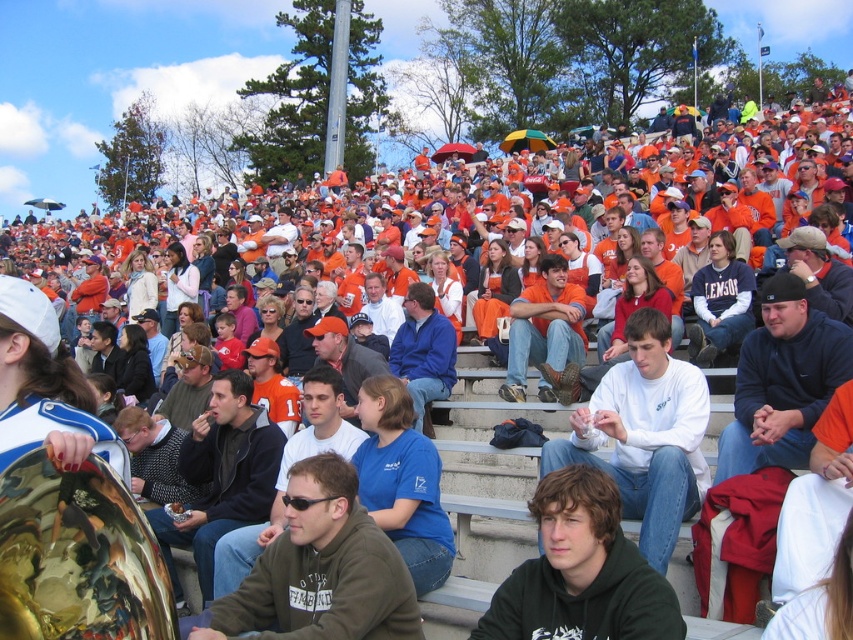
In the scene shown: Does dark blue jacket at center have a smaller size compared to orange fabric shirt at center?

Actually, dark blue jacket at center might be larger than orange fabric shirt at center.

Which is behind, point (178, 584) or point (525, 378)?

Positioned behind is point (525, 378).

The height and width of the screenshot is (640, 853). I want to click on dark blue jacket at center, so click(x=222, y=476).

The width and height of the screenshot is (853, 640). In order to click on dark blue jacket at center in this screenshot , I will do `click(222, 476)`.

Can you confirm if green hoodie at center is wider than black fleece jacket at center?

Yes.

Based on the photo, between green hoodie at center and black fleece jacket at center, which one appears on the right side from the viewer's perspective?

black fleece jacket at center

You are a GUI agent. You are given a task and a screenshot of the screen. Output one action in this format:
    pyautogui.click(x=<x>, y=<y>)
    Task: Click on the green hoodie at center
    
    Given the screenshot: What is the action you would take?
    pyautogui.click(x=581, y=572)

What are the coordinates of `dark gray hoodie at center` in the screenshot? It's located at (320, 570).

Locate an element on the screen. The width and height of the screenshot is (853, 640). dark gray hoodie at center is located at coordinates (320, 570).